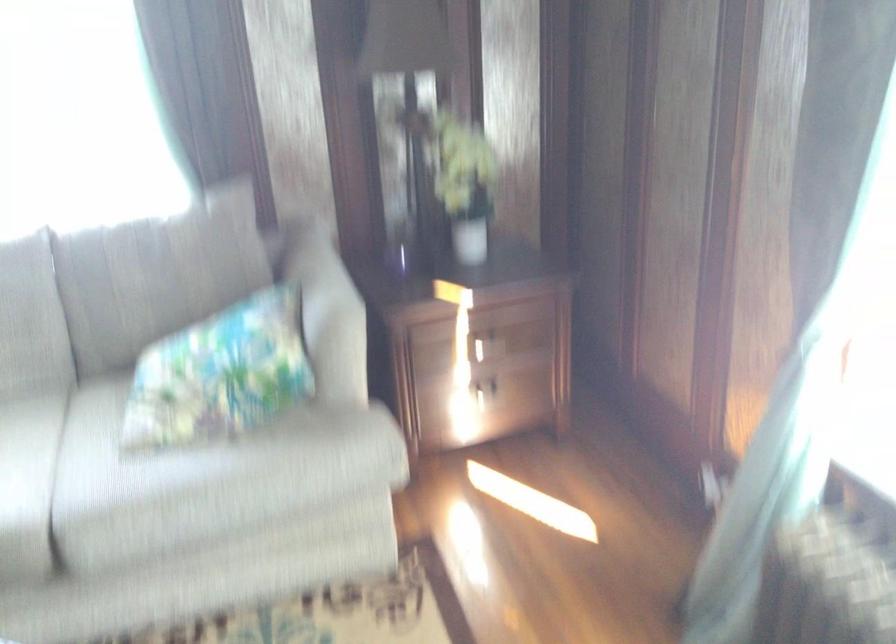
You are a GUI agent. You are given a task and a screenshot of the screen. Output one action in this format:
    pyautogui.click(x=<x>, y=<y>)
    Task: Click on the patterned throw pillow
    The height and width of the screenshot is (644, 896).
    Given the screenshot: What is the action you would take?
    220,374